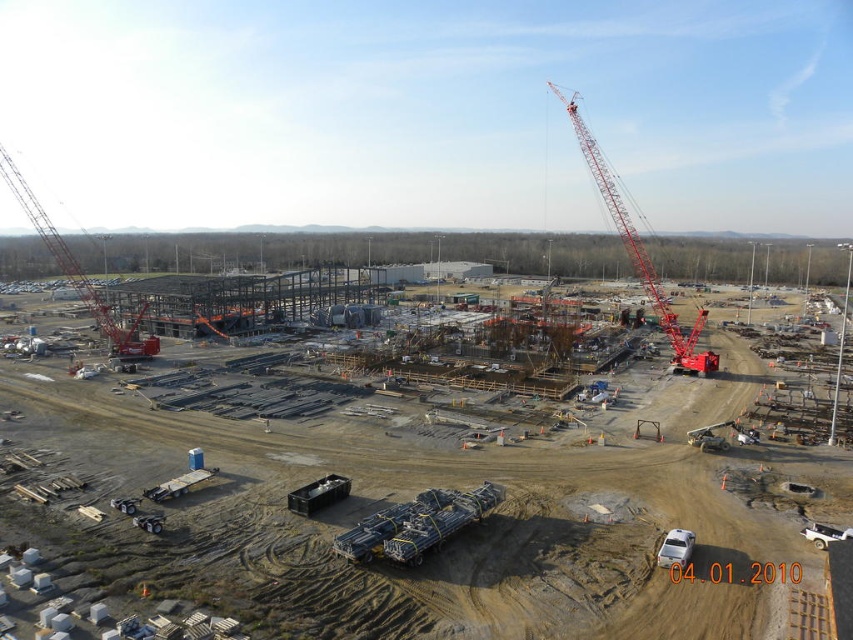
Looking at this image, you are a crane operator who needs to lift a heavy beam from the ground to the top of the metal framework at center. Considering the white plastic website at lower center is in the path, will the beam clear the website?

The metal framework at center is much taller than the white plastic website at lower center, so the beam will clear the website as long as it is lifted vertically without tilting.

You are a construction inspector evaluating the site layout. You need to ensure that the metal framework at center does not obstruct the white plastic website at lower center. Based on the spatial relationship between them, is there a risk of obstruction?

The metal framework at center might be wider than white plastic website at lower center, so there is a potential risk of obstruction depending on their exact dimensions and positioning.

You are a delivery driver arriving at the construction site and need to park your white plastic car at lower right. The construction manager says you must ensure that your car is not taller than the metal framework at center. Based on the scene, can you safely park there?

The metal framework at center is taller than the white plastic car at lower right, so yes, the driver can safely park there since the car is shorter than the framework.